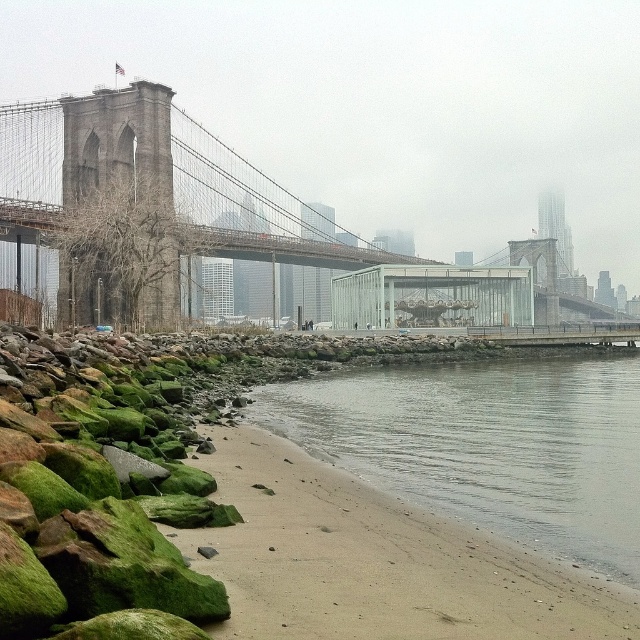
You are standing at the edge of the riverside scene and want to cross to the Brooklyn Bridge. The gray smooth water at lower center is in your path. Based on its location, can you step over it easily?

The gray smooth water at lower center is located at point (488, 444), which is likely positioned further away from your current position at the edge. Since it is in the lower center of the image, it might be part of the river itself, requiring a bridge or boat to cross rather than stepping over. Therefore, you cannot step over it easily.

You are a photographer standing at the riverside and want to capture the brown stone suspension bridge at center in the background while including the gray smooth water at lower center in the foreground. Which object should you focus on first if you want the bridge to be sharp and the water to be slightly blurred?

You should focus on the brown stone suspension bridge at center first because it is taller than the gray smooth water at lower center, allowing the water to be slightly blurred while keeping the bridge sharp.